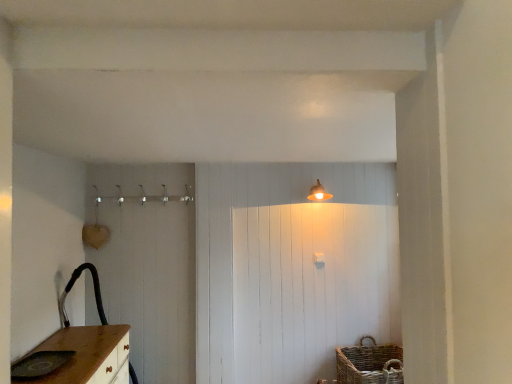
You are a GUI agent. You are given a task and a screenshot of the screen. Output one action in this format:
    pyautogui.click(x=<x>, y=<y>)
    Task: Click on the matte gray sink at lower left
    Image resolution: width=512 pixels, height=384 pixels.
    Given the screenshot: What is the action you would take?
    pyautogui.click(x=40, y=364)

What is the approximate width of matte gold light fixture at upper center?

It is 26.71 centimeters.

I want to click on matte gray sink at lower left, so click(40, 364).

Is matte gray sink at lower left oriented away from matte gold light fixture at upper center?

No, matte gray sink at lower left's orientation is not away from matte gold light fixture at upper center.

Is matte gray sink at lower left taller than matte gold light fixture at upper center?

No, matte gray sink at lower left is not taller than matte gold light fixture at upper center.

Considering the positions of objects matte gray sink at lower left and woven brown basket at lower right in the image provided, who is in front, matte gray sink at lower left or woven brown basket at lower right?

Positioned in front is matte gray sink at lower left.

Between point (34, 377) and point (353, 369), which one is positioned in front?

The point (34, 377) is more forward.

Does matte gray sink at lower left have a lesser width compared to woven brown basket at lower right?

Yes.

Consider the image. From a real-world perspective, is matte gray sink at lower left located higher than woven brown basket at lower right?

Yes.

Which object is more forward, matte gold light fixture at upper center or matte gray sink at lower left?

matte gray sink at lower left.

Can you confirm if matte gold light fixture at upper center is shorter than matte gray sink at lower left?

No.

From the picture: Does matte gold light fixture at upper center appear on the left side of matte gray sink at lower left?

In fact, matte gold light fixture at upper center is to the right of matte gray sink at lower left.

What are the coordinates of `sink lying in front of the matte gold light fixture at upper center` in the screenshot? It's located at (40, 364).

Is the depth of woven brown basket at lower right greater than that of matte gold light fixture at upper center?

No, woven brown basket at lower right is closer to the camera.

In terms of height, does woven brown basket at lower right look taller or shorter compared to matte gold light fixture at upper center?

In the image, woven brown basket at lower right appears to be taller than matte gold light fixture at upper center.

From the image's perspective, who appears lower, woven brown basket at lower right or matte gold light fixture at upper center?

woven brown basket at lower right, from the image's perspective.

Is woven brown basket at lower right situated inside matte gold light fixture at upper center or outside?

woven brown basket at lower right is spatially situated outside matte gold light fixture at upper center.

In the scene shown: Can you confirm if matte gold light fixture at upper center is smaller than woven brown basket at lower right?

Yes, matte gold light fixture at upper center is smaller than woven brown basket at lower right.

Which object is wider, matte gold light fixture at upper center or woven brown basket at lower right?

With larger width is woven brown basket at lower right.

Does matte gold light fixture at upper center lie in front of woven brown basket at lower right?

No, matte gold light fixture at upper center is behind woven brown basket at lower right.

Are woven brown basket at lower right and matte gray sink at lower left far apart?

Yes, woven brown basket at lower right and matte gray sink at lower left are quite far apart.

Is woven brown basket at lower right facing towards matte gray sink at lower left?

No, woven brown basket at lower right is not facing towards matte gray sink at lower left.

From a real-world perspective, who is located higher, woven brown basket at lower right or matte gray sink at lower left?

From a 3D spatial view, matte gray sink at lower left is above.

In terms of size, does woven brown basket at lower right appear bigger or smaller than matte gray sink at lower left?

woven brown basket at lower right is bigger than matte gray sink at lower left.

Identify the location of light fixture above the matte gray sink at lower left (from a real-world perspective). Image resolution: width=512 pixels, height=384 pixels. (318, 193).

Image resolution: width=512 pixels, height=384 pixels. I want to click on basket lying behind the matte gray sink at lower left, so click(x=369, y=363).

Based on their spatial positions, is woven brown basket at lower right or matte gold light fixture at upper center further from matte gray sink at lower left?

matte gold light fixture at upper center is positioned further to the anchor matte gray sink at lower left.

From the image, which object appears to be farther from matte gold light fixture at upper center, matte gray sink at lower left or woven brown basket at lower right?

The object further to matte gold light fixture at upper center is matte gray sink at lower left.

Looking at the image, which one is located further to matte gray sink at lower left, matte gold light fixture at upper center or woven brown basket at lower right?

Among the two, matte gold light fixture at upper center is located further to matte gray sink at lower left.

Looking at the image, which one is located closer to woven brown basket at lower right, matte gold light fixture at upper center or matte gray sink at lower left?

The object closer to woven brown basket at lower right is matte gold light fixture at upper center.

Based on their spatial positions, is matte gray sink at lower left or matte gold light fixture at upper center further from woven brown basket at lower right?

matte gray sink at lower left is further to woven brown basket at lower right.

Considering their positions, is woven brown basket at lower right positioned closer to matte gold light fixture at upper center than matte gray sink at lower left?

Among the two, woven brown basket at lower right is located nearer to matte gold light fixture at upper center.

What are the coordinates of `light fixture located between matte gray sink at lower left and woven brown basket at lower right in the left-right direction` in the screenshot? It's located at (318, 193).